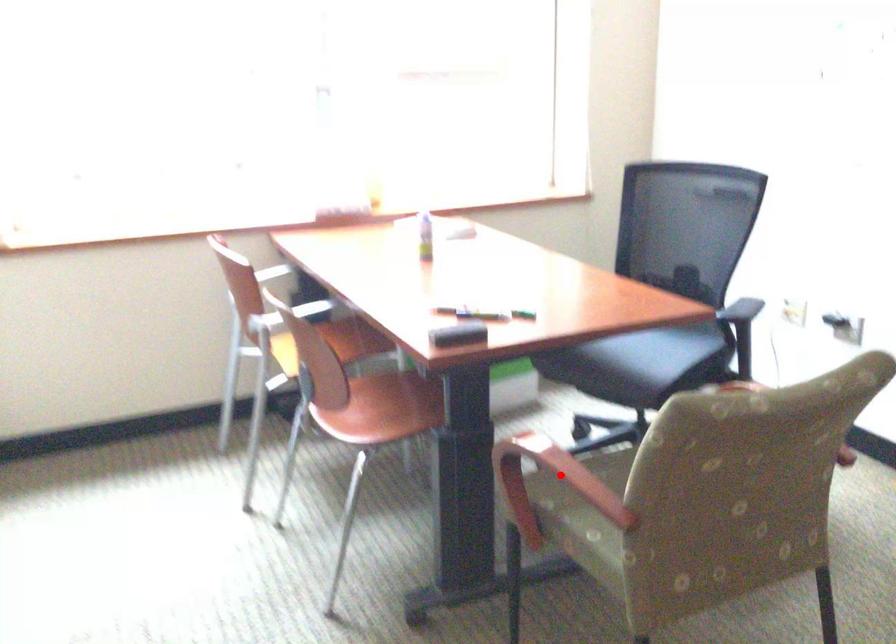
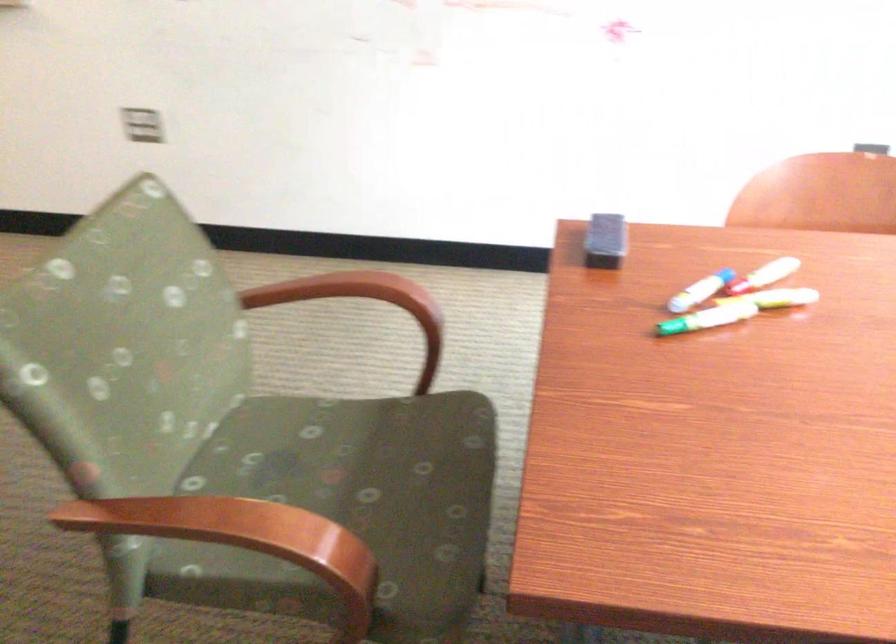
Find the pixel in the second image that matches the highlighted location in the first image.

(305, 304)